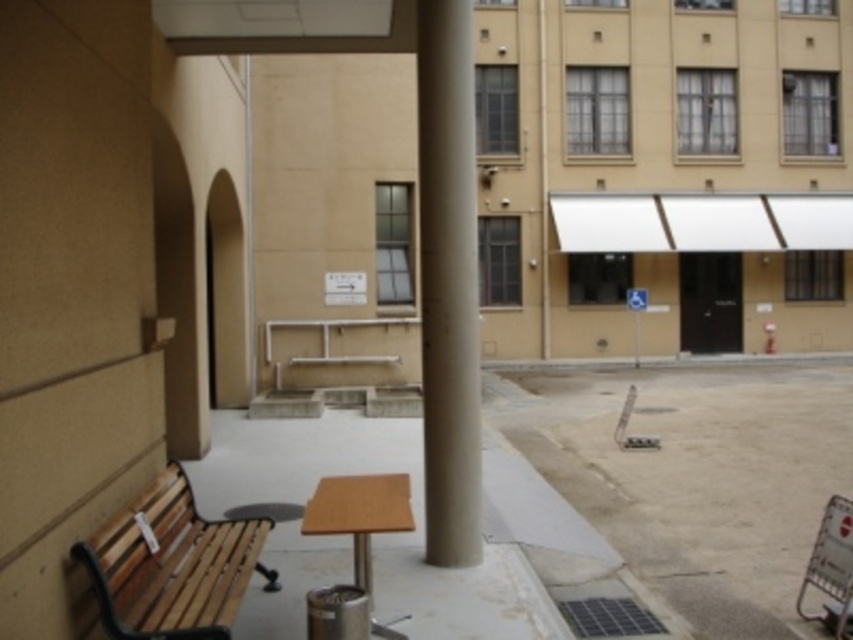
You are standing in the courtyard and want to find the smooth concrete pillar at center. Based on the coordinates given, where should you look relative to the wooden bench with metal armrests and legs and the small round table with light brown top and metallic base?

The smooth concrete pillar at center is located at coordinates point (448, 282), so you should look towards the center of the courtyard, between the wooden bench with metal armrests and legs and the small round table with light brown top and metallic base.

You are a delivery person trying to navigate a cart through the courtyard. The cart is 1.2 meters wide. There is a smooth concrete pavement at center and a smooth concrete pillar at center. Which path can you safely pass through without hitting the pillar?

The smooth concrete pavement at center is wider than the smooth concrete pillar at center. Since the cart is 1.2 meters wide, you can safely pass through the smooth concrete pavement at center as it is wider than the pillar.

You are planning to place a new flower pot in the courtyard. The flower pot is 1 meter tall. You want to ensure that the flower pot is visible from the entrance, which is located near the smooth concrete pillar at center. Considering the wooden park bench at lower left is behind the pillar, will the flower pot placed at the pillar block the view of the bench from the entrance?

The wooden park bench at lower left is behind the smooth concrete pillar at center, so placing the flower pot at the pillar would block the view of the bench from the entrance.